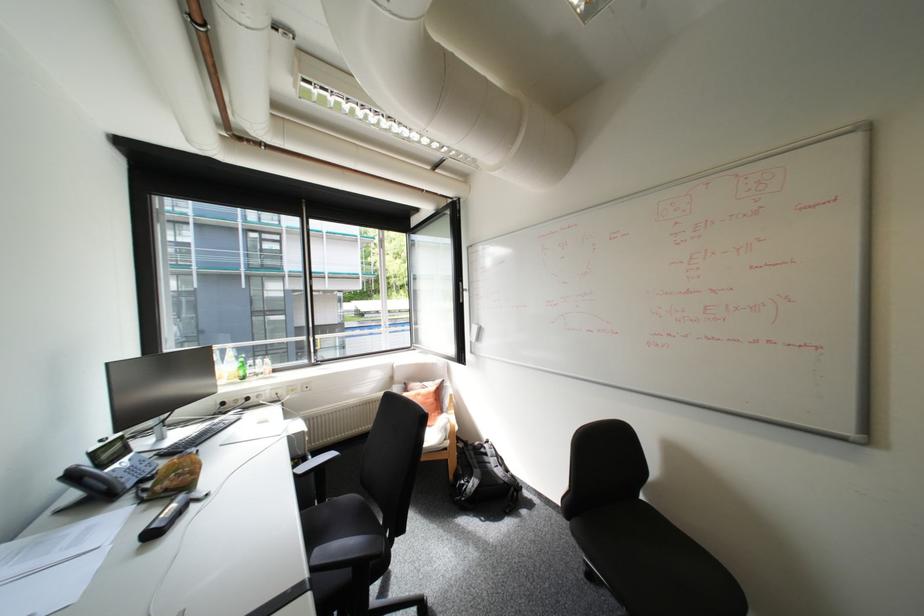
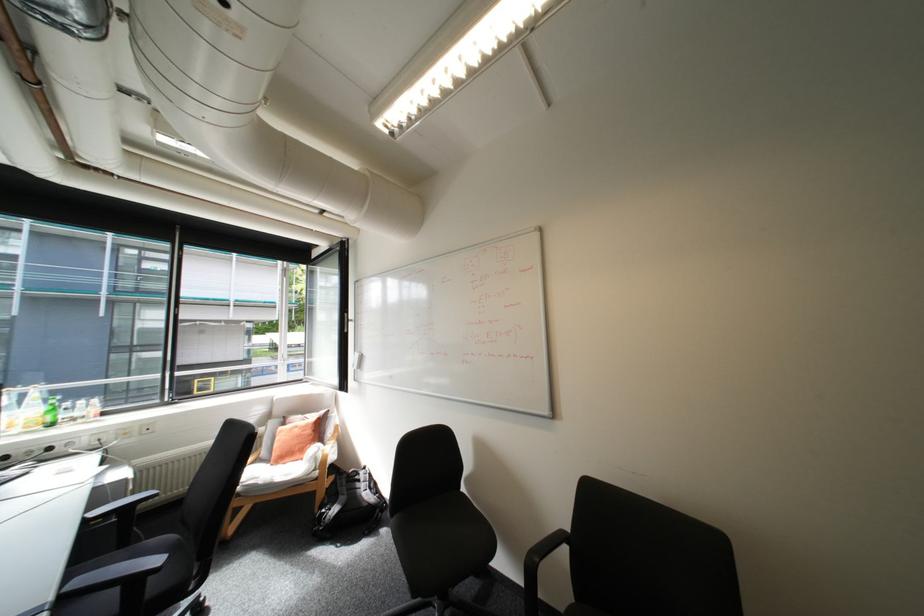
Where in the second image is the point corresponding to (x=315, y=573) from the first image?

(61, 598)